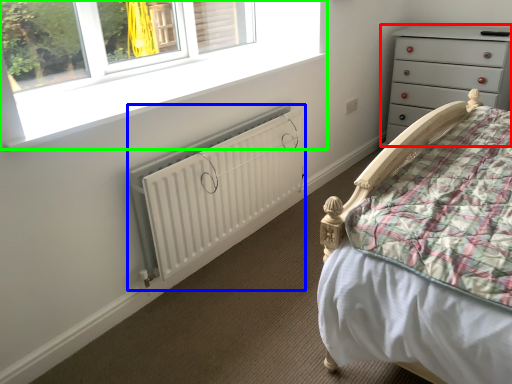
Question: Considering the real-world distances, which object is closest to chest of drawers (highlighted by a red box)? radiator (highlighted by a blue box) or window (highlighted by a green box).

Choices:
 (A) radiator
 (B) window

Answer: (B)